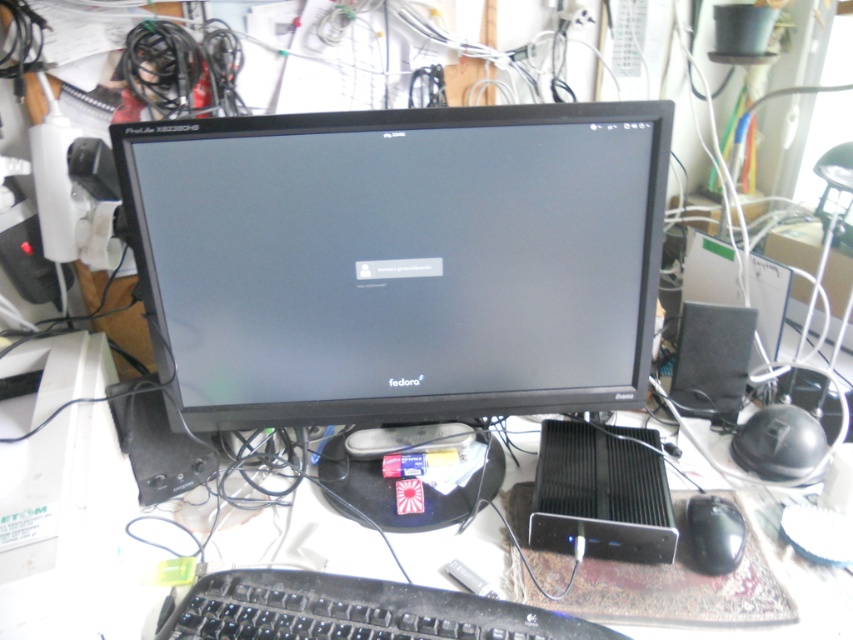
You are organizing your desk and need to place a new cable organizer. The black plastic keyboard at lower center is currently in the way. Where should you move the keyboard to make space for the organizer?

The black plastic keyboard at lower center is located at point (355, 611). To make space for the cable organizer, you could move it to a nearby area that is not obstructing the workspace, such as to the left or right of its current position, ensuring it remains accessible for use.

You are setting up a new ergonomic workstation and need to ensure that your black plastic keyboard at lower center and black matte mouse at lower right are within comfortable reach. According to ergonomic guidelines, the maximum recommended distance between a keyboard and mouse should be 18 inches. Is your current setup compliant with these guidelines?

The black plastic keyboard at lower center and black matte mouse at lower right are 31.35 centimeters apart. Since 31.35 centimeters is approximately 12.34 inches, which is less than the 18 inches recommended, the setup complies with ergonomic guidelines.

Consider the image. You are organizing your desk and want to move the black matte computer at center closer to the black matte mouse at lower right. Based on their current positions, which direction should you move the computer to align them properly?

The black matte computer at center is positioned on the left side of the black matte mouse at lower right. To align them properly, you should move the computer to the right towards the mouse.